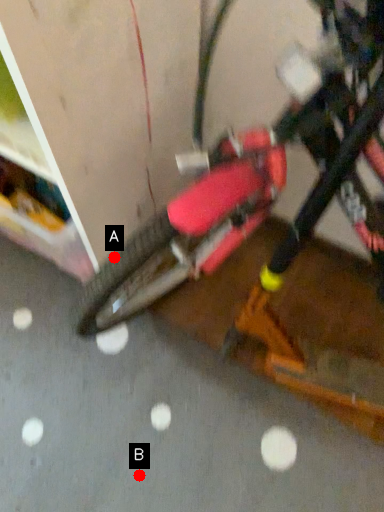
Question: Two points are circled on the image, labeled by A and B beside each circle. Which point appears farthest from the camera in this image?

Choices:
 (A) A is further
 (B) B is further

Answer: (B)